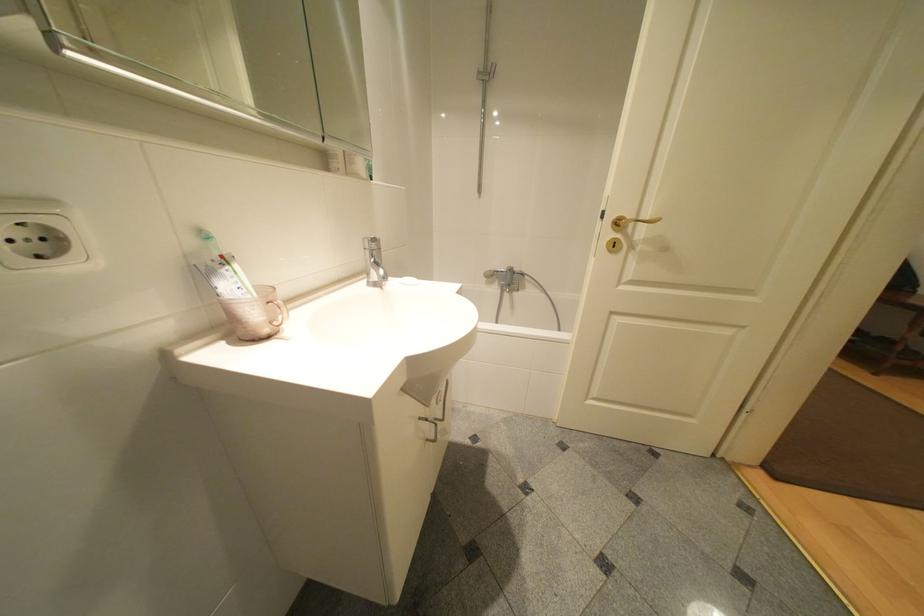
Find the location of a particular element. The image size is (924, 616). gold door handle is located at coordinates (645, 223).